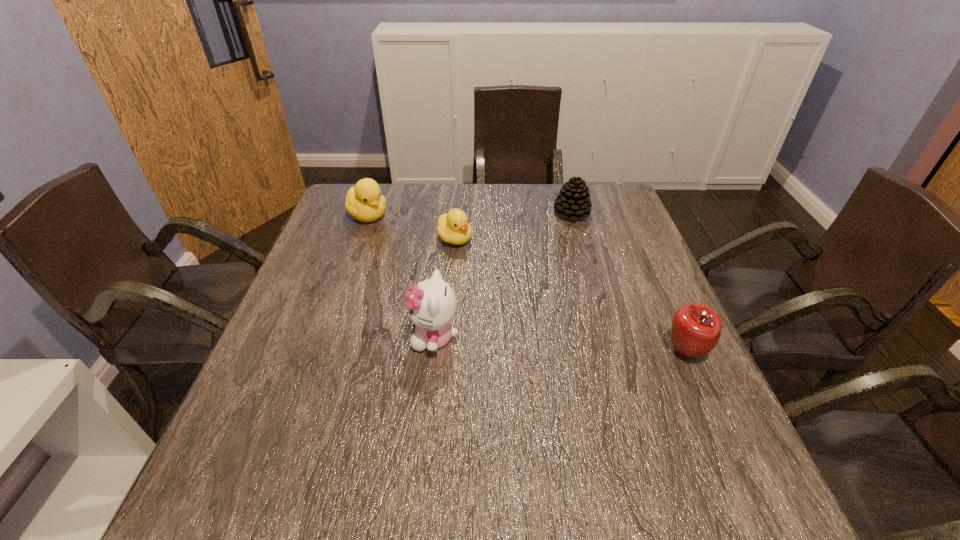
At what (x,y) coordinates should I click in order to perform the action: click on vacant space in between the tallest object and the leftmost object. Please return your answer as a coordinate pair (x, y). This screenshot has width=960, height=540. Looking at the image, I should click on (401, 276).

Where is `free spot between the tallest object and the apple`? The image size is (960, 540). free spot between the tallest object and the apple is located at coordinates (560, 345).

Where is `object that is the second closest to the rightmost object`? This screenshot has width=960, height=540. object that is the second closest to the rightmost object is located at coordinates (431, 306).

Select which object appears as the third closest to the fourth object from left to right. Please provide its 2D coordinates. Your answer should be formatted as a tuple, i.e. [(x, y)], where the tuple contains the x and y coordinates of a point satisfying the conditions above.

[(431, 306)]

Locate an element on the screen. Image resolution: width=960 pixels, height=540 pixels. free location that satisfies the following two spatial constraints: 1. on the front side of the tallest object; 2. on the front-facing side of the duck is located at coordinates (325, 337).

The image size is (960, 540). Identify the location of free region that satisfies the following two spatial constraints: 1. on the front side of the apple; 2. on the right side of the fourth object from left to right. (611, 352).